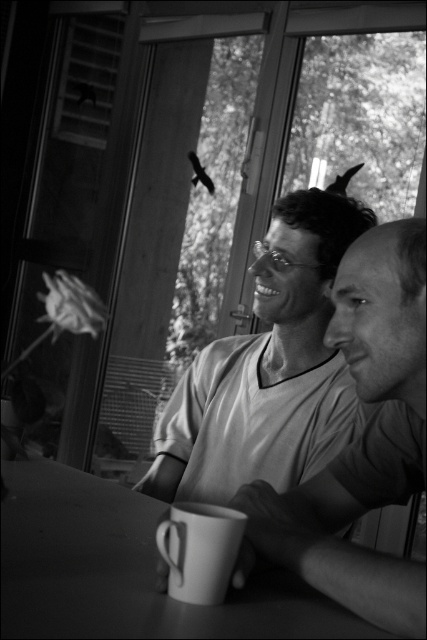
Who is lower down, smooth white shirt at center or white matte mug at lower center?

white matte mug at lower center

Is smooth white shirt at center wider than white matte mug at lower center?

Correct, the width of smooth white shirt at center exceeds that of white matte mug at lower center.

Is point (365, 554) positioned after point (184, 572)?

Yes, point (365, 554) is behind point (184, 572).

The width and height of the screenshot is (427, 640). In order to click on smooth white shirt at center in this screenshot , I will do `click(363, 438)`.

Which is in front, point (332, 525) or point (300, 600)?

Point (300, 600) is in front.

Who is more forward, (371, 392) or (289, 596)?

Point (289, 596) is more forward.

Where is `smooth white shirt at center`? The height and width of the screenshot is (640, 427). smooth white shirt at center is located at coordinates (363, 438).

Measure the distance between smooth matte table at center and white matte mug at lower center.

They are 18.50 centimeters apart.

Which of these two, smooth matte table at center or white matte mug at lower center, stands shorter?

smooth matte table at center is shorter.

Where is `smooth matte table at center`? smooth matte table at center is located at coordinates (126, 570).